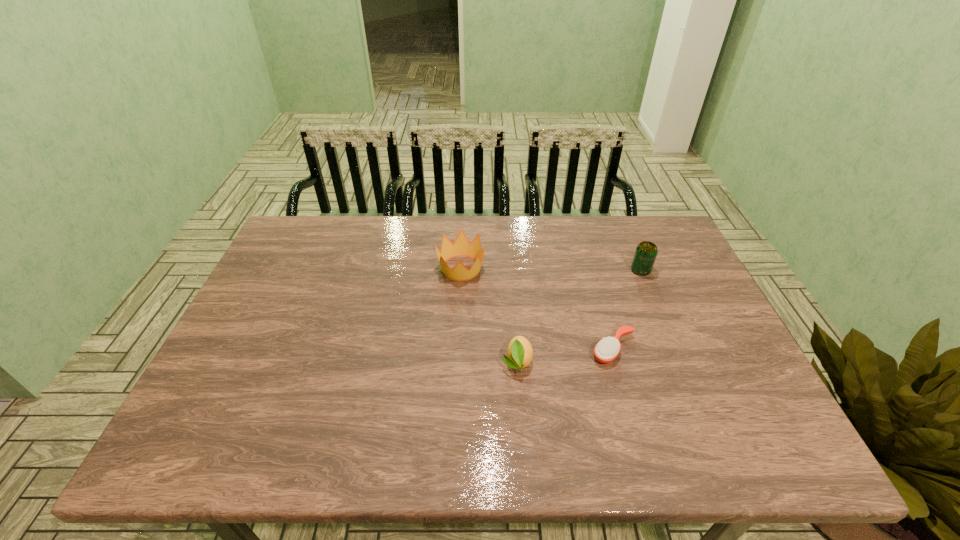
I want to click on free space in the image that satisfies the following two spatial constraints: 1. on the front side of the hairbrush; 2. on the left side of the leftmost object, so click(457, 349).